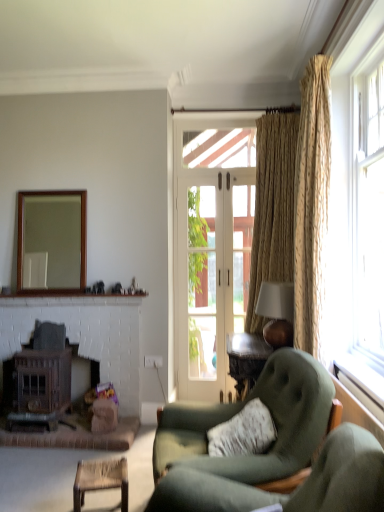
Where is `vacant point above wooden frame mirror at upper left (from a real-world perspective)`? The image size is (384, 512). vacant point above wooden frame mirror at upper left (from a real-world perspective) is located at coordinates (56, 185).